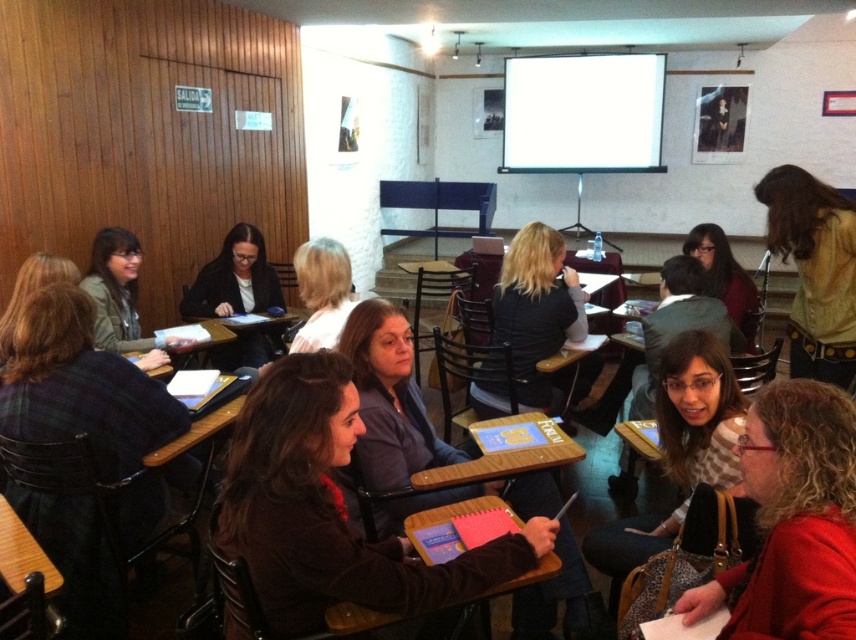
Is yellow textured blouse at right positioned behind dark brown hair at center?

No, it is in front of dark brown hair at center.

Does yellow textured blouse at right have a greater width compared to dark brown hair at center?

Incorrect, yellow textured blouse at right's width does not surpass dark brown hair at center's.

Find the location of a particular element. Image resolution: width=856 pixels, height=640 pixels. yellow textured blouse at right is located at coordinates (813, 269).

Which is below, dark brown sweater at center or yellow textured blouse at right?

dark brown sweater at center is lower down.

Consider the image. Is dark brown sweater at center thinner than yellow textured blouse at right?

No.

Where is `dark brown sweater at center`? The width and height of the screenshot is (856, 640). dark brown sweater at center is located at coordinates (331, 509).

Locate an element on the screen. dark brown sweater at center is located at coordinates (331, 509).

Is matte green jacket at left to the right of matte black hair at center from the viewer's perspective?

Incorrect, matte green jacket at left is not on the right side of matte black hair at center.

Between matte green jacket at left and matte black hair at center, which one has less height?

With less height is matte green jacket at left.

Which is in front, point (111, 288) or point (746, 298)?

Positioned in front is point (111, 288).

Where is `matte green jacket at left`? This screenshot has width=856, height=640. matte green jacket at left is located at coordinates (120, 294).